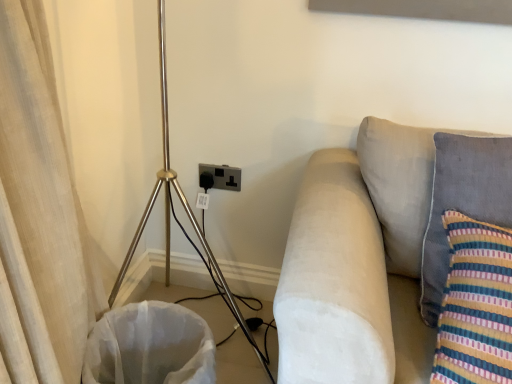
Question: Considering the relative positions of white fabric laundry basket at lower left and suede beige couch at right in the image provided, is white fabric laundry basket at lower left to the left of suede beige couch at right from the viewer's perspective?

Choices:
 (A) yes
 (B) no

Answer: (A)

Question: Does white fabric laundry basket at lower left have a lesser height compared to suede beige couch at right?

Choices:
 (A) yes
 (B) no

Answer: (A)

Question: From a real-world perspective, is white fabric laundry basket at lower left located higher than suede beige couch at right?

Choices:
 (A) no
 (B) yes

Answer: (A)

Question: Is white fabric laundry basket at lower left closer to the viewer compared to suede beige couch at right?

Choices:
 (A) no
 (B) yes

Answer: (A)

Question: From the image's perspective, is white fabric laundry basket at lower left beneath suede beige couch at right?

Choices:
 (A) no
 (B) yes

Answer: (B)

Question: Is white fabric laundry basket at lower left aimed at suede beige couch at right?

Choices:
 (A) yes
 (B) no

Answer: (B)

Question: Is velvety gray pillow at right looking in the opposite direction of beige fabric curtain at left?

Choices:
 (A) no
 (B) yes

Answer: (A)

Question: Is velvety gray pillow at right facing towards beige fabric curtain at left?

Choices:
 (A) yes
 (B) no

Answer: (B)

Question: Is velvety gray pillow at right outside beige fabric curtain at left?

Choices:
 (A) no
 (B) yes

Answer: (B)

Question: Would you consider velvety gray pillow at right to be distant from beige fabric curtain at left?

Choices:
 (A) yes
 (B) no

Answer: (B)

Question: Is the surface of velvety gray pillow at right in direct contact with beige fabric curtain at left?

Choices:
 (A) yes
 (B) no

Answer: (B)

Question: Does velvety gray pillow at right have a greater width compared to beige fabric curtain at left?

Choices:
 (A) no
 (B) yes

Answer: (A)

Question: Is suede beige couch at right beside velvety gray pillow at right?

Choices:
 (A) no
 (B) yes

Answer: (A)